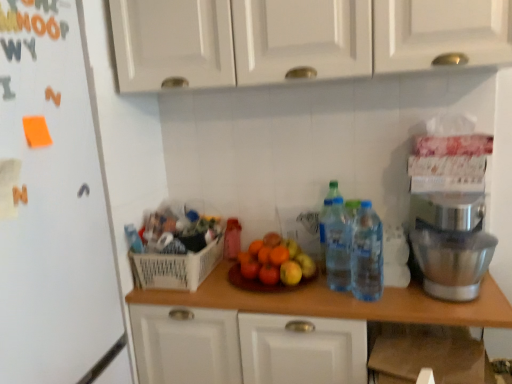
The width and height of the screenshot is (512, 384). Find the location of `free location to the left of translucent plastic bottles at center right`. free location to the left of translucent plastic bottles at center right is located at coordinates (327, 300).